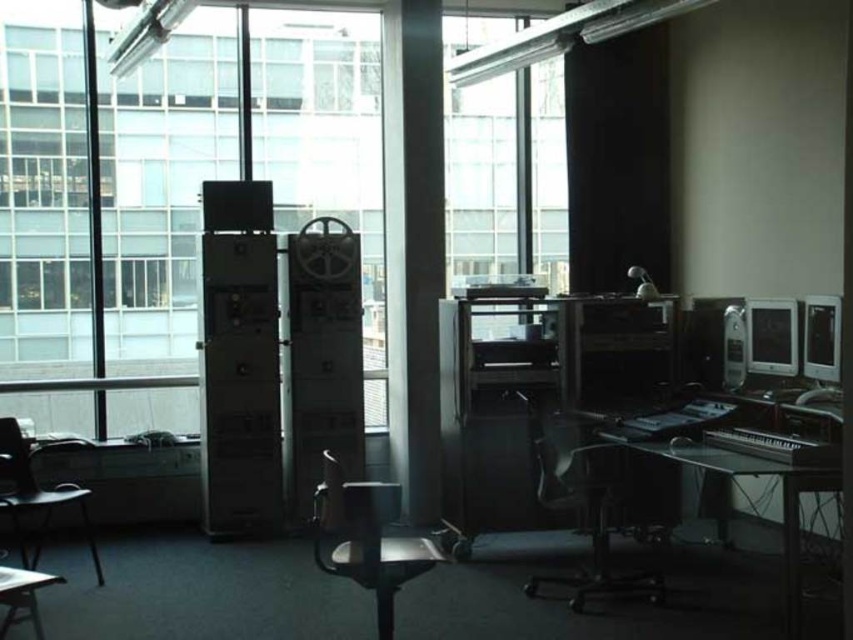
Measure the distance between matte black monitor at right and camera.

matte black monitor at right is 4.31 meters from camera.

Based on the photo, is matte black monitor at right to the right of metallic silver speaker at right from the viewer's perspective?

Indeed, matte black monitor at right is positioned on the right side of metallic silver speaker at right.

This screenshot has width=853, height=640. Describe the element at coordinates (821, 339) in the screenshot. I see `matte black monitor at right` at that location.

The width and height of the screenshot is (853, 640). Find the location of `matte black monitor at right`. matte black monitor at right is located at coordinates (821, 339).

Can you confirm if metallic silver swivel chair at center is positioned below black glass table at lower right?

Yes.

Does metallic silver swivel chair at center lie behind black glass table at lower right?

That is False.

Between point (381, 568) and point (782, 468), which one is positioned behind?

Positioned behind is point (782, 468).

Where is `metallic silver swivel chair at center`? The width and height of the screenshot is (853, 640). metallic silver swivel chair at center is located at coordinates (366, 538).

Does point (210, 83) come closer to viewer compared to point (778, 316)?

No.

Identify the location of transparent glass window at center. The image size is (853, 640). (161, 186).

Who is more distant from viewer, [54,83] or [759,300]?

The point [54,83] is behind.

Find the location of `transparent glass window at center`. transparent glass window at center is located at coordinates (161, 186).